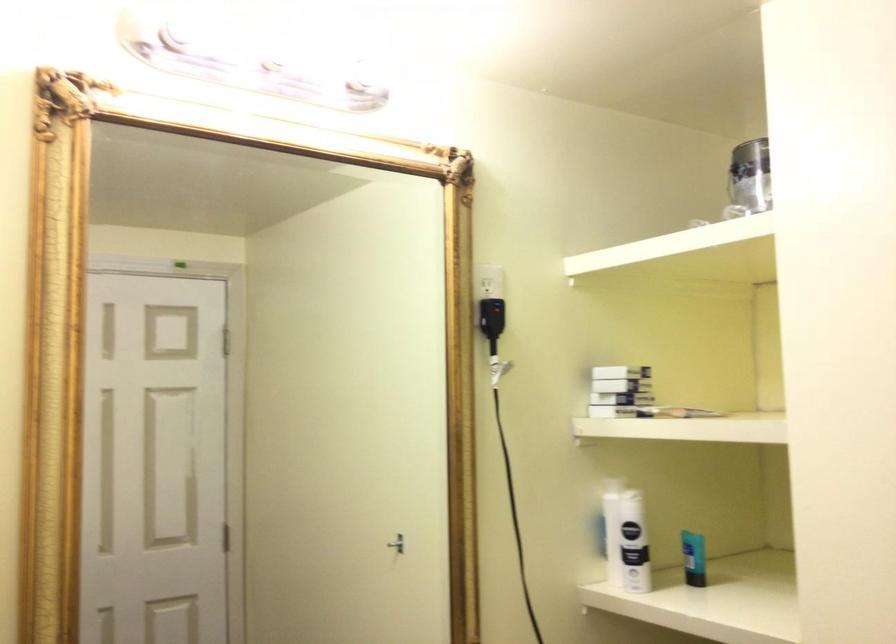
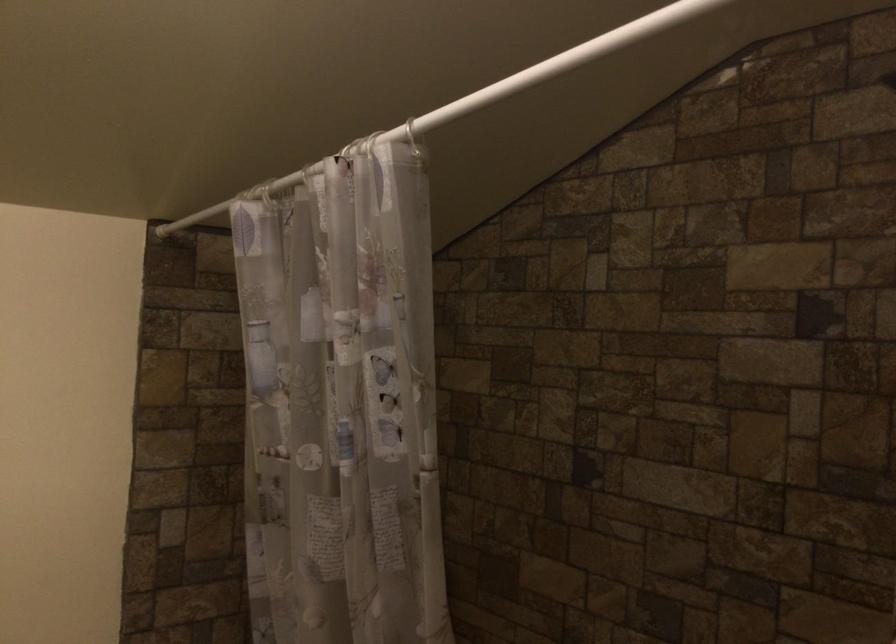
Question: The images are taken continuously from a first-person perspective. In which direction is your viewpoint rotating?

Choices:
 (A) Left
 (B) Right
 (C) Up
 (D) Down

Answer: (A)